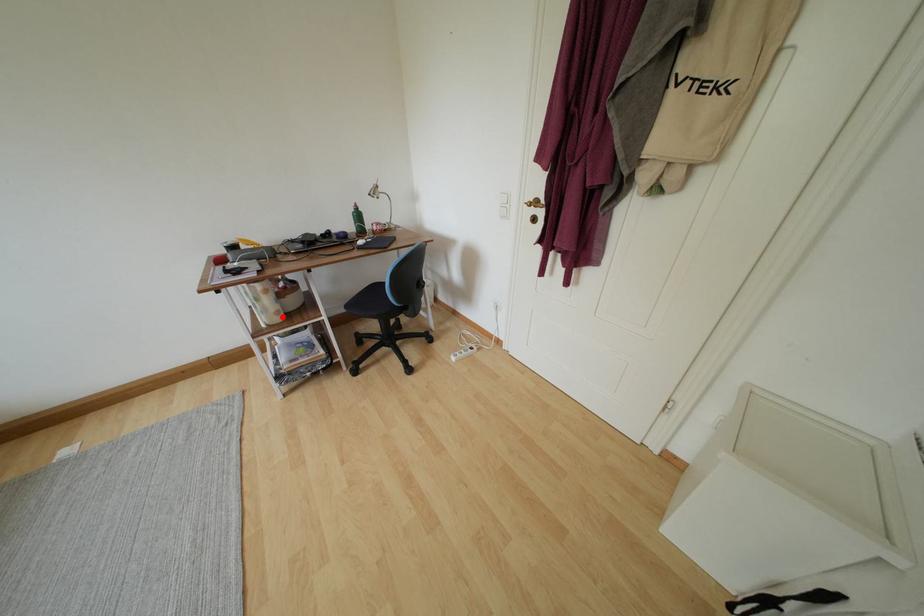
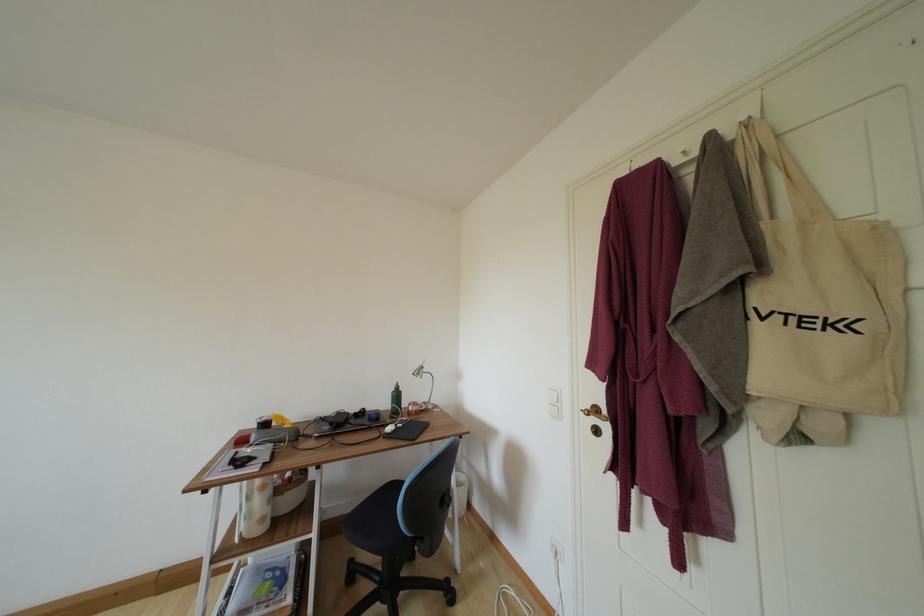
In the second image, find the point that corresponds to the highlighted location in the first image.

(266, 524)